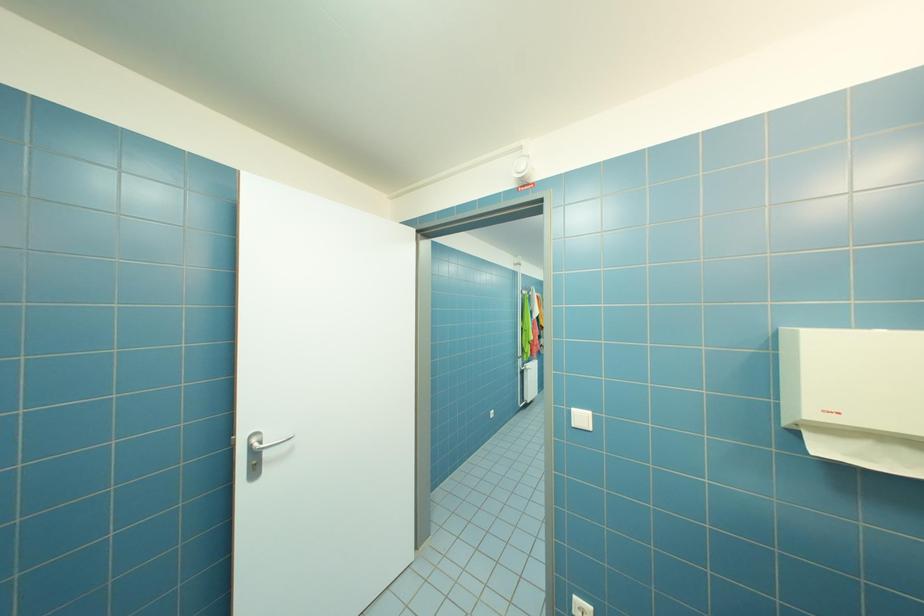
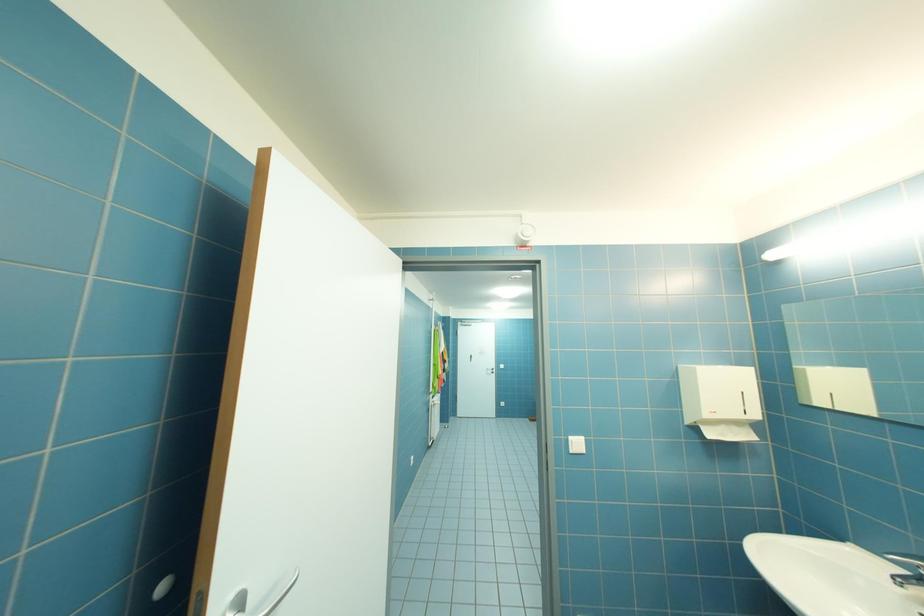
Question: How did the camera likely rotate?

Choices:
 (A) Left
 (B) Right
 (C) Up
 (D) Down

Answer: (B)